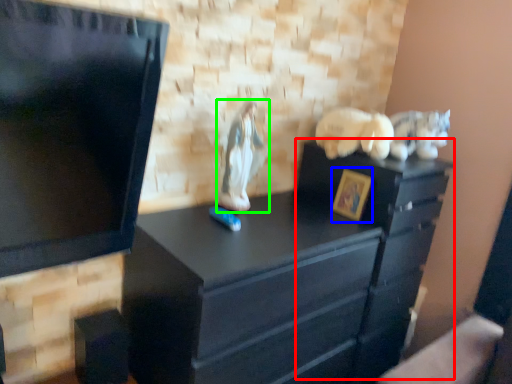
Question: Which object is positioned farthest from file cabinet (highlighted by a red box)? Select from picture frame (highlighted by a blue box) and animal (highlighted by a green box).

Choices:
 (A) picture frame
 (B) animal

Answer: (B)